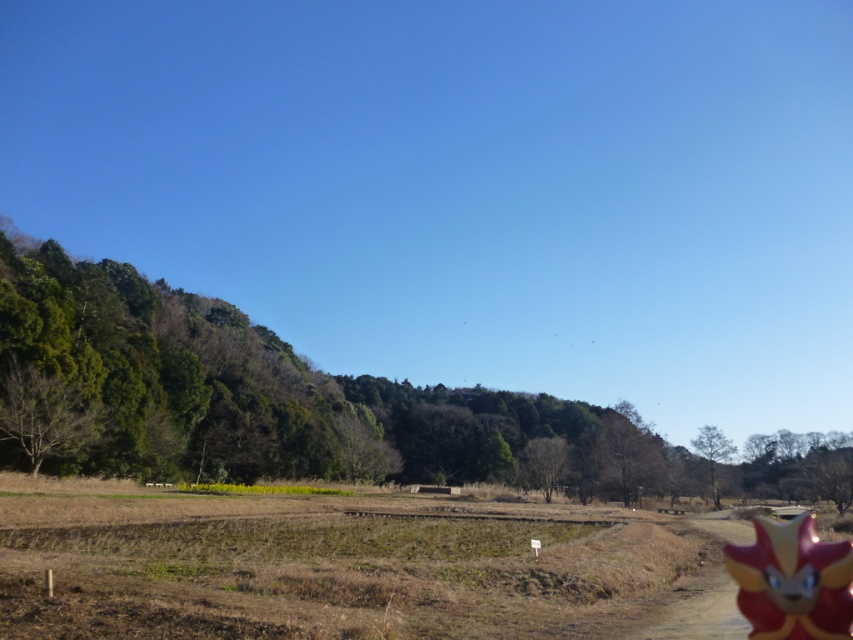
Question: Does brown soil at center have a smaller size compared to shiny plastic toy at lower right?

Choices:
 (A) no
 (B) yes

Answer: (A)

Question: Is brown soil at center in front of shiny plastic toy at lower right?

Choices:
 (A) yes
 (B) no

Answer: (B)

Question: Considering the relative positions of brown soil at center and shiny plastic toy at lower right in the image provided, where is brown soil at center located with respect to shiny plastic toy at lower right?

Choices:
 (A) left
 (B) right

Answer: (A)

Question: Which object appears farthest from the camera in this image?

Choices:
 (A) shiny plastic toy at lower right
 (B) brown soil at center

Answer: (B)

Question: Which object appears closest to the camera in this image?

Choices:
 (A) brown soil at center
 (B) shiny plastic toy at lower right

Answer: (B)